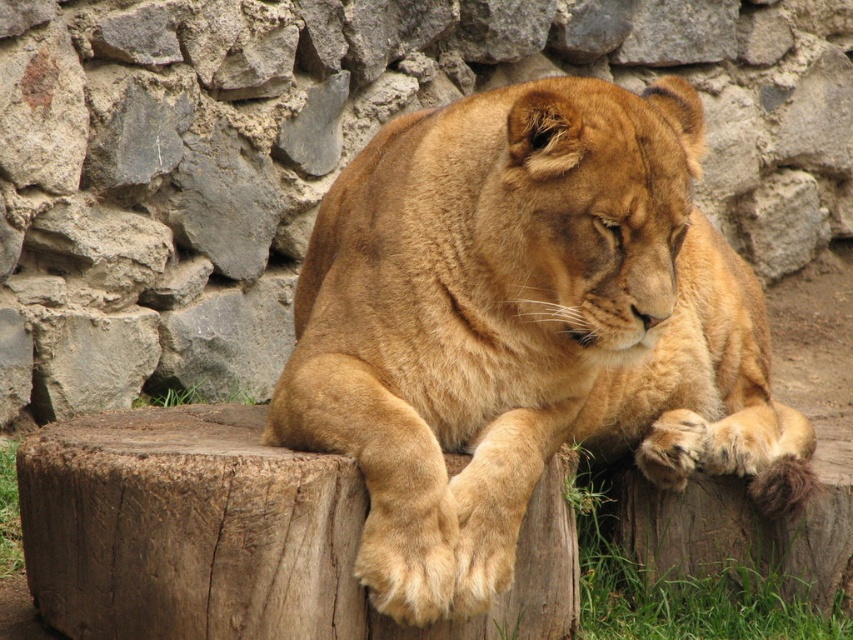
Can you confirm if golden fur lion at center is taller than green grass at lower left?

Yes.

Between golden fur lion at center and green grass at lower left, which one appears on the right side from the viewer's perspective?

golden fur lion at center

I want to click on golden fur lion at center, so click(x=524, y=326).

Is golden fur lion at center bigger than green grass at lower right?

Yes, golden fur lion at center is bigger than green grass at lower right.

Can you confirm if golden fur lion at center is thinner than green grass at lower right?

No, golden fur lion at center is not thinner than green grass at lower right.

From the picture: Who is more distant from viewer, (402, 193) or (762, 586)?

Positioned behind is point (762, 586).

Where is `golden fur lion at center`? golden fur lion at center is located at coordinates (524, 326).

Which of these two, green grass at lower right or green grass at lower left, stands taller?

Standing taller between the two is green grass at lower right.

Does green grass at lower right have a greater width compared to green grass at lower left?

Indeed, green grass at lower right has a greater width compared to green grass at lower left.

Does point (749, 637) lie behind point (1, 499)?

No, it is in front of (1, 499).

Where is `green grass at lower right`? The height and width of the screenshot is (640, 853). green grass at lower right is located at coordinates (686, 577).